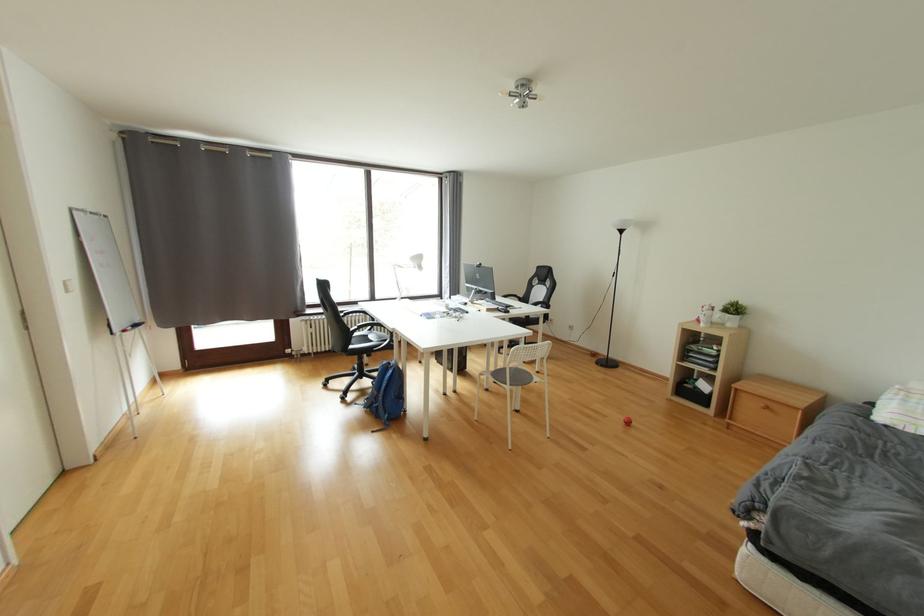
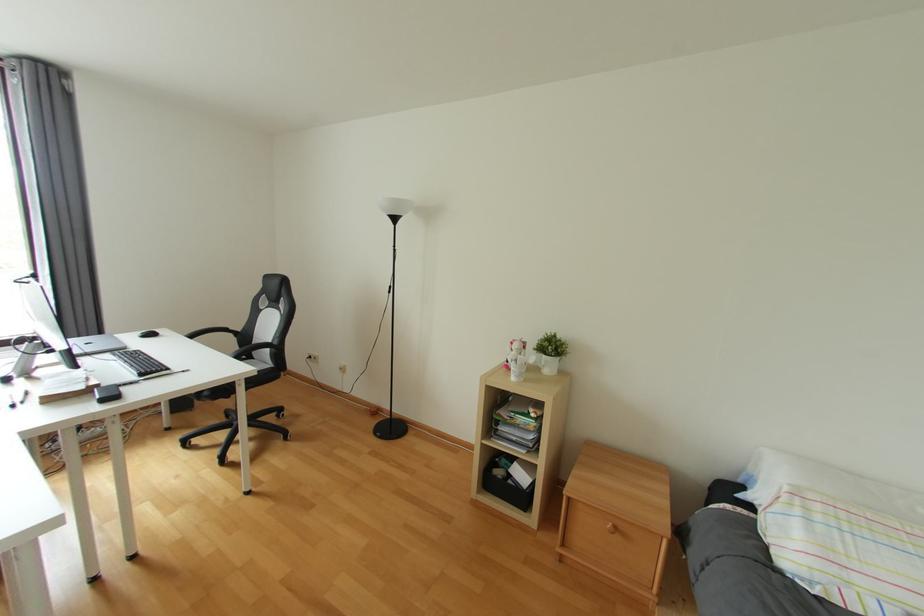
What movement of the cameraman would produce the second image?

The movement direction of the cameraman is right, forward.